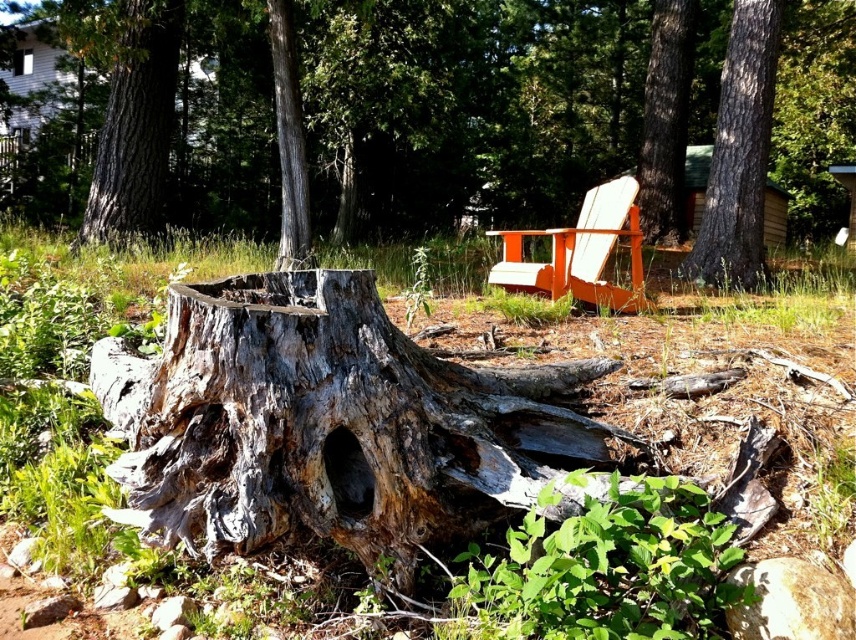
You are planning to place a new bench in your backyard. You see the gray rough bark tree trunk at upper left and the orange wood chair at center. Which object takes up more space in the scene?

The gray rough bark tree trunk at upper left takes up more space in the scene as it is bigger than the orange wood chair at center.

You are planning to place a new orange wood chair at center in your backyard. You notice there is a gray rough bark tree trunk at upper left nearby. Which object is wider?

The gray rough bark tree trunk at upper left is wider than the orange wood chair at center.

You are standing in the backyard and want to place a small garden statue between the weathered wood stump at center and the gray rough bark tree trunk at upper left. Based on their positions, which object should the statue be closer to?

The statue should be closer to the weathered wood stump at center because it is in front of the gray rough bark tree trunk at upper left, meaning the stump is closer to you.